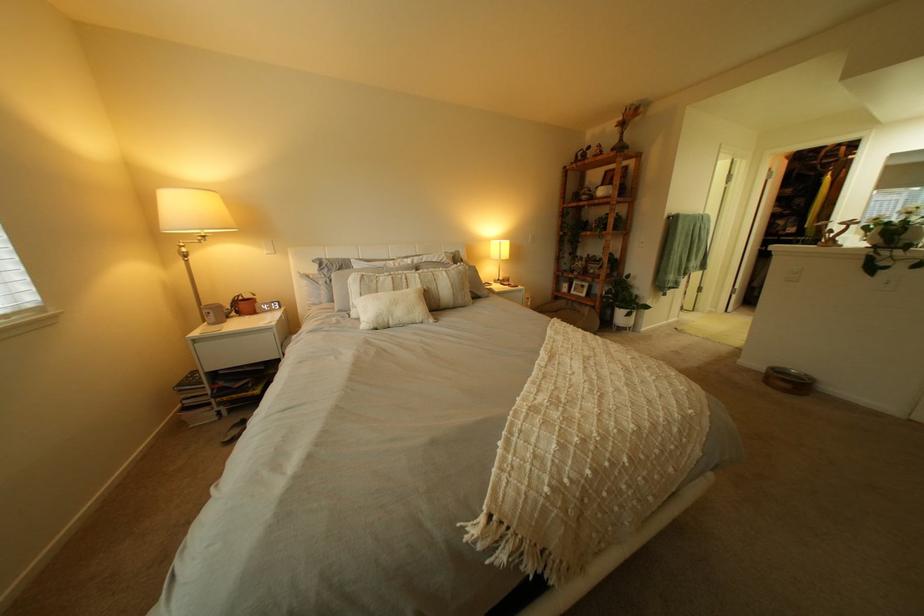
Identify the location of white drawer handle. (237, 341).